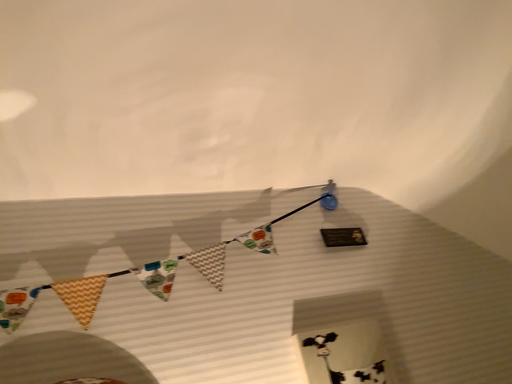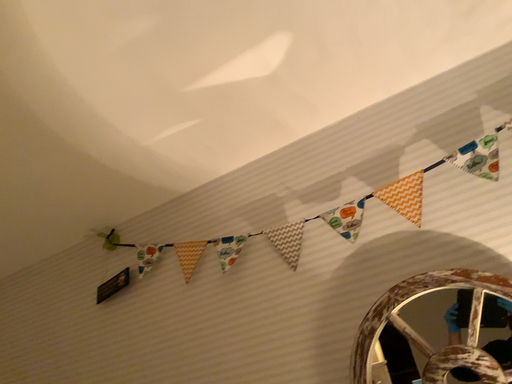
Question: How did the camera likely rotate when shooting the video?

Choices:
 (A) rotated right
 (B) rotated left

Answer: (B)